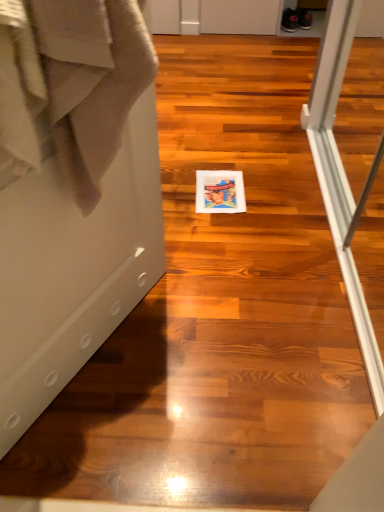
Question: Based on their positions, is beige cotton bath towel at left located to the left or right of matte paper postcard at center?

Choices:
 (A) left
 (B) right

Answer: (A)

Question: Is beige cotton bath towel at left wider or thinner than matte paper postcard at center?

Choices:
 (A) wide
 (B) thin

Answer: (B)

Question: Which of these objects is positioned farthest from the matte paper postcard at center?

Choices:
 (A) beige cotton bath towel at left
 (B) white glossy screen door at center

Answer: (A)

Question: Which is farther from the matte paper postcard at center?

Choices:
 (A) white glossy screen door at center
 (B) beige cotton bath towel at left

Answer: (B)